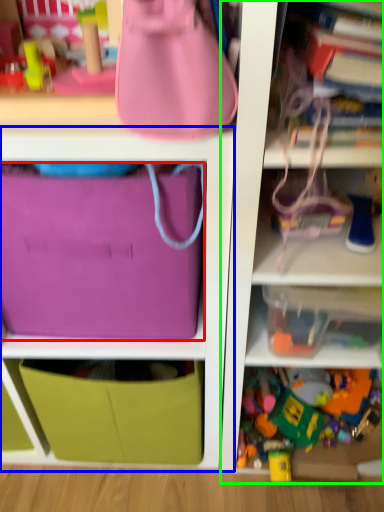
Question: Based on their relative distances, which object is farther from pouch (highlighted by a red box)? Choose from cabinet (highlighted by a blue box) and shelf (highlighted by a green box).

Choices:
 (A) cabinet
 (B) shelf

Answer: (B)